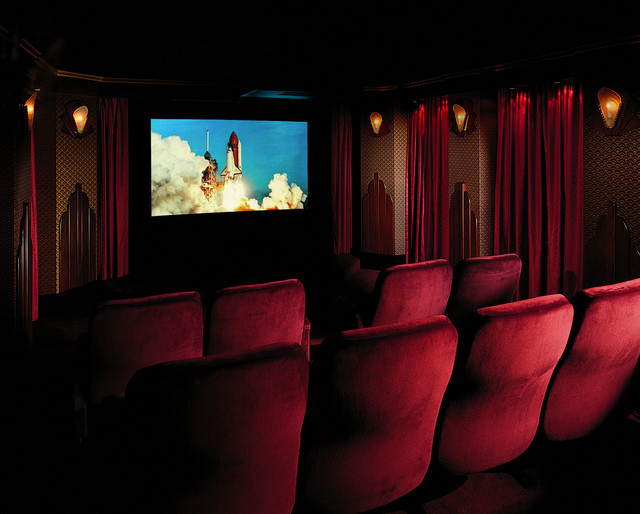
Locate an element on the screen. curtain is located at coordinates (576, 165), (528, 195), (429, 222), (132, 229), (32, 280).